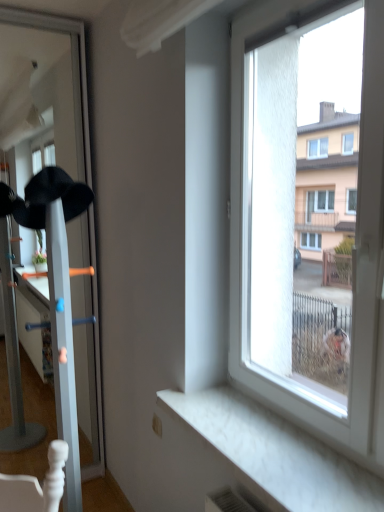
Question: Can you confirm if white glossy coat rack at left is shorter than black matte baseball hat at left?

Choices:
 (A) yes
 (B) no

Answer: (B)

Question: Would you say white glossy coat rack at left is outside black matte baseball hat at left?

Choices:
 (A) no
 (B) yes

Answer: (B)

Question: Is white glossy coat rack at left touching black matte baseball hat at left?

Choices:
 (A) no
 (B) yes

Answer: (A)

Question: Is white glossy coat rack at left wider than black matte baseball hat at left?

Choices:
 (A) yes
 (B) no

Answer: (A)

Question: Is white glossy coat rack at left positioned behind black matte baseball hat at left?

Choices:
 (A) no
 (B) yes

Answer: (A)

Question: Looking at the image, does white marble window sill at lower right seem bigger or smaller compared to black matte baseball hat at left?

Choices:
 (A) big
 (B) small

Answer: (A)

Question: Would you say white marble window sill at lower right is to the left or to the right of black matte baseball hat at left in the picture?

Choices:
 (A) left
 (B) right

Answer: (B)

Question: Choose the correct answer: Is white marble window sill at lower right inside black matte baseball hat at left or outside it?

Choices:
 (A) outside
 (B) inside

Answer: (A)

Question: Relative to black matte baseball hat at left, is white marble window sill at lower right in front or behind?

Choices:
 (A) behind
 (B) front

Answer: (B)

Question: From a real-world perspective, is white marble window sill at lower right positioned above or below white glossy coat rack at left?

Choices:
 (A) above
 (B) below

Answer: (B)

Question: In the image, is white marble window sill at lower right positioned in front of or behind white glossy coat rack at left?

Choices:
 (A) behind
 (B) front

Answer: (B)

Question: Would you say white marble window sill at lower right is inside or outside white glossy coat rack at left?

Choices:
 (A) inside
 (B) outside

Answer: (B)

Question: Is point (339, 501) closer or farther from the camera than point (41, 22)?

Choices:
 (A) farther
 (B) closer

Answer: (B)

Question: Is point (36, 177) closer or farther from the camera than point (99, 415)?

Choices:
 (A) closer
 (B) farther

Answer: (A)

Question: From their relative heights in the image, would you say black matte baseball hat at left is taller or shorter than white glossy coat rack at left?

Choices:
 (A) tall
 (B) short

Answer: (B)